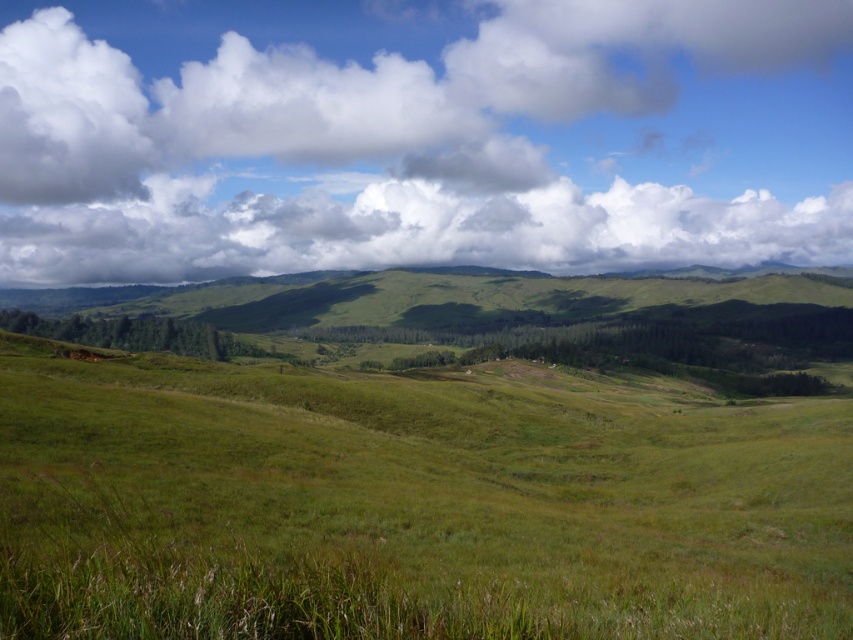
You are a drone operator trying to capture a photo of the green grassy field at center and the white fluffy cloud at upper center. Based on the scene description, which object would appear closer to the camera in the photo?

The green grassy field at center appears closer to the camera than the white fluffy cloud at upper center because it is smaller, indicating it is farther away. Wait, no, actually, the description says the green grassy field is smaller than the cloud. Hmm, maybe I need to think again. In perspective, closer objects are larger. If the field is smaller, it might be farther. But the question is about which is closer. The cloud is larger, so it might be closer. But the scene says the cloud is at upper center, so

Looking at this image, you are a drone operator trying to capture aerial footage of the green grassy field at center and the white fluffy cloud at upper center. Based on their heights, which object should you prioritize capturing from a lower altitude?

The green grassy field at center is not as tall as the white fluffy cloud at upper center, so you should prioritize capturing the green grassy field at center from a lower altitude since it is shorter.